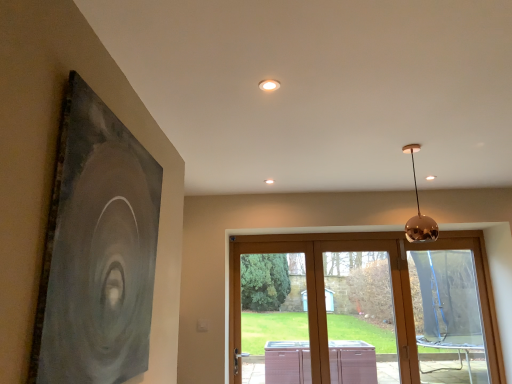
Question: Looking at their shapes, would you say transparent plastic window at lower right, which appears as the 1th window when viewed from the right, is wider or thinner than wooden sliding door at center, arranged as the second window when viewed from the left?

Choices:
 (A) wide
 (B) thin

Answer: (B)

Question: In the image, is transparent plastic window at lower right, which appears as the 1th window when viewed from the right, on the left side or the right side of wooden sliding door at center, arranged as the second window when viewed from the left?

Choices:
 (A) left
 (B) right

Answer: (B)

Question: Estimate the real-world distances between objects in this image. Which object is closer to the transparent plastic window at lower right, which appears as the 1th window when viewed from the right?

Choices:
 (A) matte black painting at left
 (B) clear glass door at center, the third window when ordered from right to left
 (C) white glossy light fixture at upper center
 (D) wooden sliding door at center, arranged as the second window when viewed from the left
 (E) polished copper sphere at upper right

Answer: (B)

Question: Which of these objects is positioned closest to the matte black painting at left?

Choices:
 (A) white glossy light fixture at upper center
 (B) transparent plastic window at lower right, which appears as the 1th window when viewed from the right
 (C) wooden sliding door at center, arranged as the second window when viewed from the left
 (D) clear glass door at center, the 1th window in the left-to-right sequence
 (E) polished copper sphere at upper right

Answer: (A)